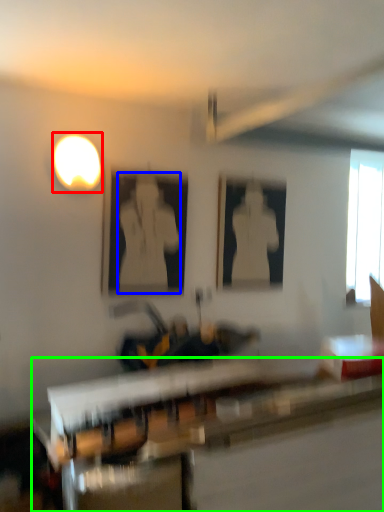
Question: Which is farther away from light (highlighted by a red box)? person (highlighted by a blue box) or table (highlighted by a green box)?

Choices:
 (A) person
 (B) table

Answer: (B)